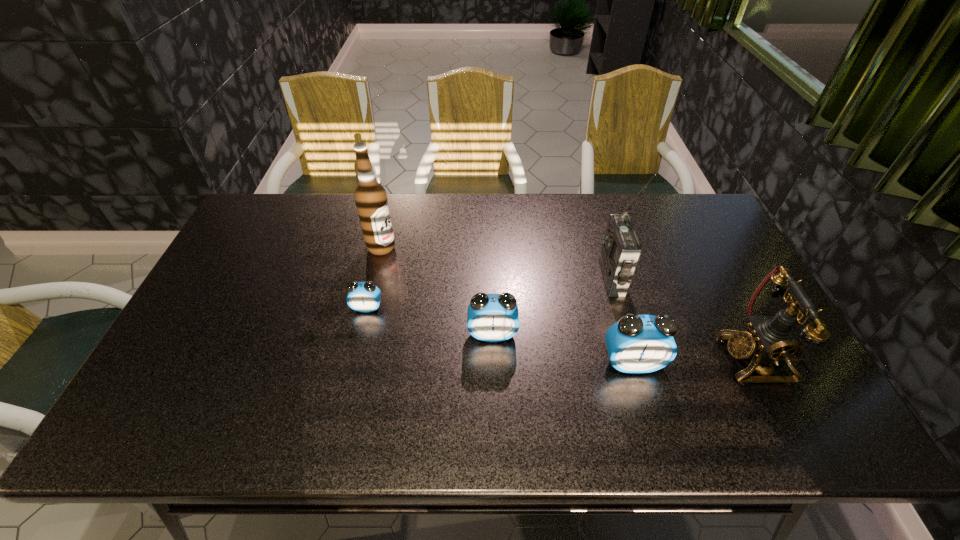
At what (x,y) coordinates should I click in order to perform the action: click on the farthest alarm clock. Please return your answer as a coordinate pair (x, y). Image resolution: width=960 pixels, height=540 pixels. Looking at the image, I should click on (364, 297).

Where is `the shortest object`? This screenshot has height=540, width=960. the shortest object is located at coordinates (364, 297).

This screenshot has height=540, width=960. In order to click on the second shortest alarm clock in this screenshot , I will do `click(493, 317)`.

You are a GUI agent. You are given a task and a screenshot of the screen. Output one action in this format:
    pyautogui.click(x=<x>, y=<y>)
    Task: Click on the second alarm clock from left to right
    The width and height of the screenshot is (960, 540).
    Given the screenshot: What is the action you would take?
    pyautogui.click(x=493, y=317)

Locate an element on the screen. The image size is (960, 540). the nearest alarm clock is located at coordinates (637, 344).

Find the location of a particular element. the rightmost object is located at coordinates (769, 338).

Where is `telephone`? The height and width of the screenshot is (540, 960). telephone is located at coordinates (769, 338).

Where is `alcohol`? The width and height of the screenshot is (960, 540). alcohol is located at coordinates (370, 197).

Find the location of a particular element. The height and width of the screenshot is (540, 960). radio receiver is located at coordinates (621, 249).

Image resolution: width=960 pixels, height=540 pixels. I want to click on free space located 0.210m on the face of the shortest object, so click(x=350, y=381).